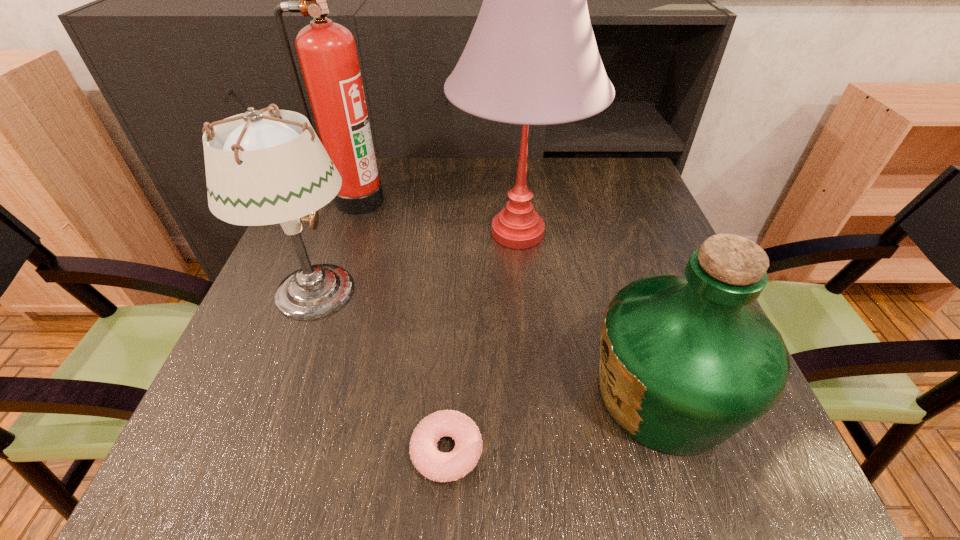
At what (x,y) coordinates should I click in order to perform the action: click on the third closest object to the second shortest object. Please return your answer as a coordinate pair (x, y). This screenshot has width=960, height=540. Looking at the image, I should click on (260, 170).

I want to click on vacant space that satisfies the following two spatial constraints: 1. on the lampshade of the third tallest object; 2. on the right side of the shortest object, so click(x=255, y=451).

You are a GUI agent. You are given a task and a screenshot of the screen. Output one action in this format:
    pyautogui.click(x=<x>, y=<y>)
    Task: Click on the vacant position in the image that satisfies the following two spatial constraints: 1. with the nozzle pointing from the back of the fire extinguisher; 2. on the right side of the doughnut
    Image resolution: width=960 pixels, height=540 pixels.
    Given the screenshot: What is the action you would take?
    pyautogui.click(x=271, y=451)